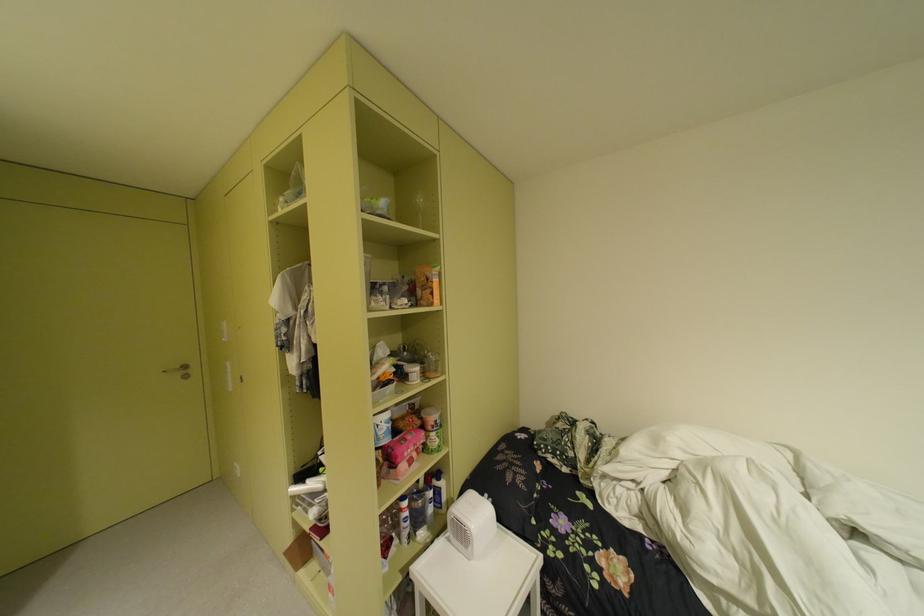
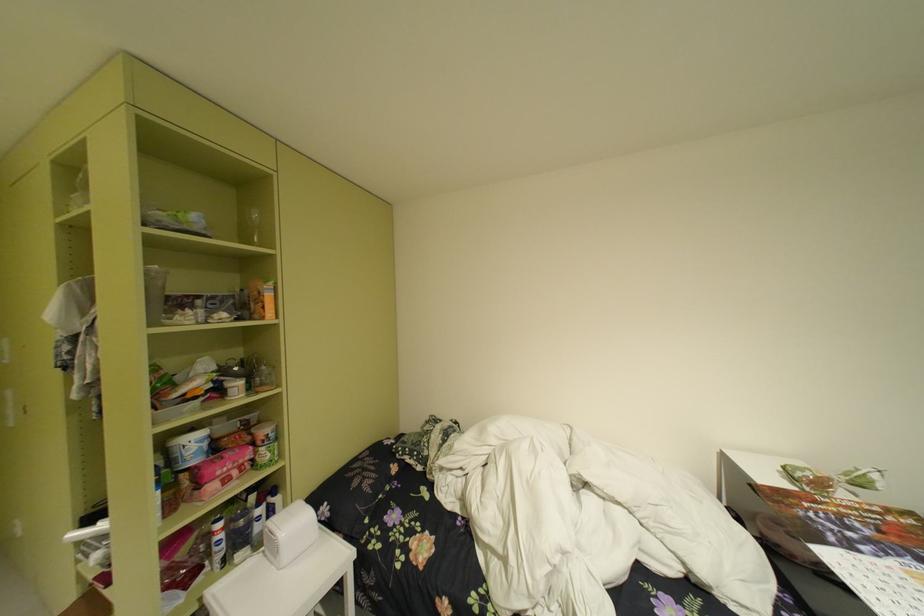
Locate, in the second image, the point that corresponds to point (442, 509) in the first image.

(269, 528)